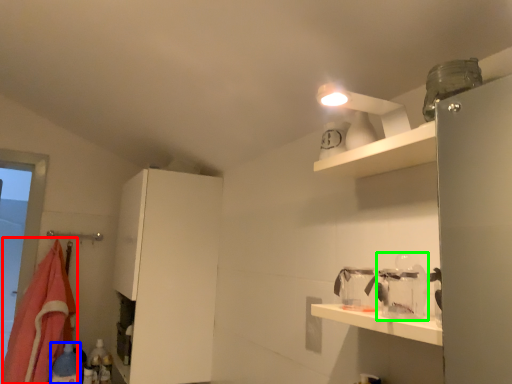
Question: Considering the real-world distances, which object is closest to blanket (highlighted by a red box)? bottle (highlighted by a blue box) or glass jar (highlighted by a green box).

Choices:
 (A) bottle
 (B) glass jar

Answer: (A)